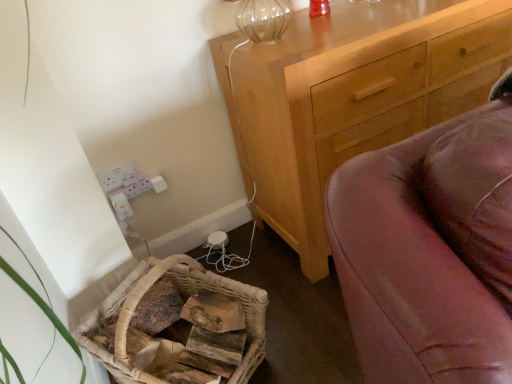
Question: In terms of width, does woven wood basket at lower left look wider or thinner when compared to light brown wooden chest of drawers at upper right?

Choices:
 (A) wide
 (B) thin

Answer: (B)

Question: In terms of size, does woven wood basket at lower left appear bigger or smaller than light brown wooden chest of drawers at upper right?

Choices:
 (A) big
 (B) small

Answer: (B)

Question: Does point (96, 317) appear closer or farther from the camera than point (505, 26)?

Choices:
 (A) closer
 (B) farther

Answer: (A)

Question: Considering the positions of light brown wooden chest of drawers at upper right and woven wood basket at lower left in the image, is light brown wooden chest of drawers at upper right wider or thinner than woven wood basket at lower left?

Choices:
 (A) wide
 (B) thin

Answer: (A)

Question: Considering the positions of point (355, 132) and point (233, 375), is point (355, 132) closer or farther from the camera than point (233, 375)?

Choices:
 (A) closer
 (B) farther

Answer: (B)

Question: From the image's perspective, relative to woven wood basket at lower left, is light brown wooden chest of drawers at upper right above or below?

Choices:
 (A) above
 (B) below

Answer: (A)

Question: Is light brown wooden chest of drawers at upper right inside the boundaries of woven wood basket at lower left, or outside?

Choices:
 (A) inside
 (B) outside

Answer: (B)